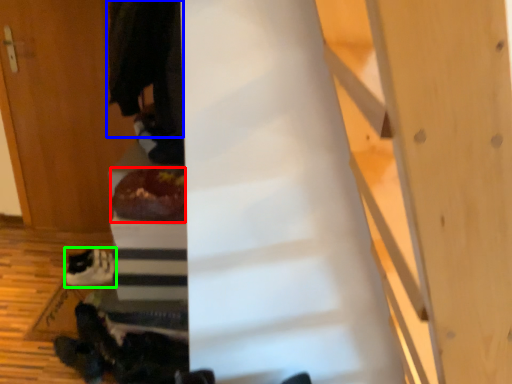
Question: Considering the real-world distances, which object is closest to food (highlighted by a red box)? robe (highlighted by a blue box) or footwear (highlighted by a green box).

Choices:
 (A) robe
 (B) footwear

Answer: (A)